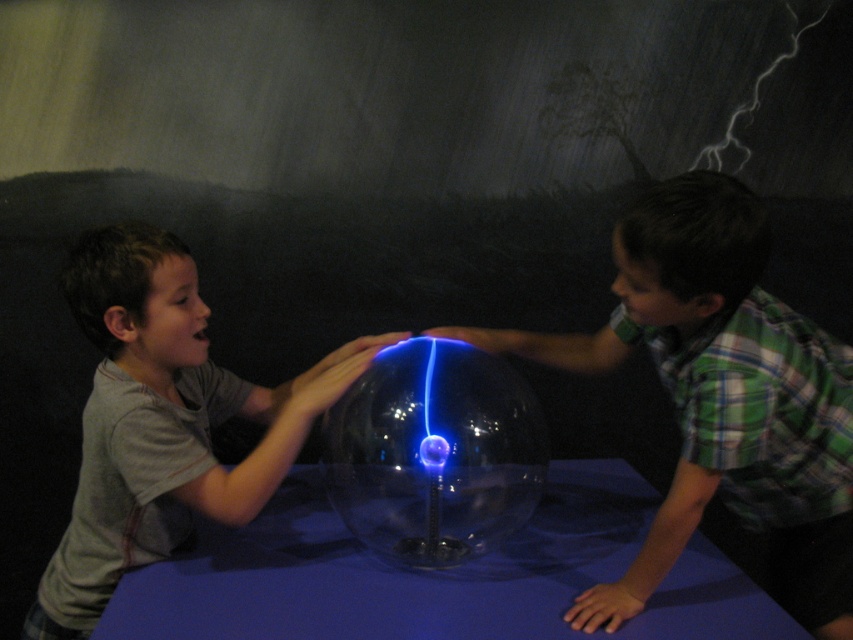
Does green plaid shirt at right have a lesser width compared to matte gray shirt at left?

In fact, green plaid shirt at right might be wider than matte gray shirt at left.

Does green plaid shirt at right have a greater width compared to matte gray shirt at left?

Yes.

Does point (740, 252) come farther from viewer compared to point (85, 410)?

That is False.

Find the location of `green plaid shirt at right`. green plaid shirt at right is located at coordinates (722, 397).

Is the position of blue fabric table at center more distant than that of matte gray shirt at left?

No, it is not.

The height and width of the screenshot is (640, 853). I want to click on blue fabric table at center, so click(438, 577).

Between point (432, 616) and point (149, 396), which one is positioned in front?

Point (432, 616) is in front.

Image resolution: width=853 pixels, height=640 pixels. Find the location of `blue fabric table at center`. blue fabric table at center is located at coordinates (438, 577).

Is the position of green plaid shirt at right less distant than that of transparent glass sphere at center?

→ That is True.

At what (x,y) coordinates should I click in order to perform the action: click on green plaid shirt at right. Please return your answer as a coordinate pair (x, y). The image size is (853, 640). Looking at the image, I should click on (722, 397).

This screenshot has height=640, width=853. What do you see at coordinates (722, 397) in the screenshot?
I see `green plaid shirt at right` at bounding box center [722, 397].

You are a GUI agent. You are given a task and a screenshot of the screen. Output one action in this format:
    pyautogui.click(x=<x>, y=<y>)
    Task: Click on the green plaid shirt at right
    This screenshot has height=640, width=853.
    Given the screenshot: What is the action you would take?
    pyautogui.click(x=722, y=397)